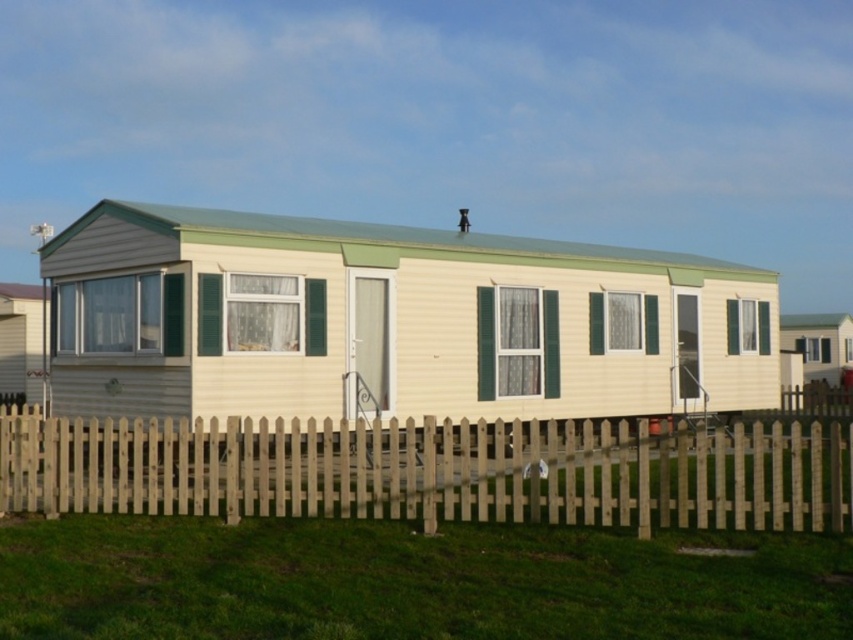
Question: Is green grass at lower center bigger than wooden picket fence at lower center?

Choices:
 (A) no
 (B) yes

Answer: (A)

Question: Can you confirm if matte yellow trailer at center is thinner than green grass at lower center?

Choices:
 (A) no
 (B) yes

Answer: (A)

Question: Observing the image, what is the correct spatial positioning of green grass at lower center in reference to wooden picket fence at lower center?

Choices:
 (A) left
 (B) right

Answer: (A)

Question: Which point is farther to the camera?

Choices:
 (A) matte yellow trailer at center
 (B) green grass at lower center
 (C) wooden picket fence at lower center

Answer: (A)

Question: Estimate the real-world distances between objects in this image. Which object is farther from the wooden picket fence at lower center?

Choices:
 (A) matte yellow trailer at center
 (B) green grass at lower center

Answer: (B)

Question: Which point appears farthest from the camera in this image?

Choices:
 (A) (248, 305)
 (B) (538, 444)

Answer: (A)